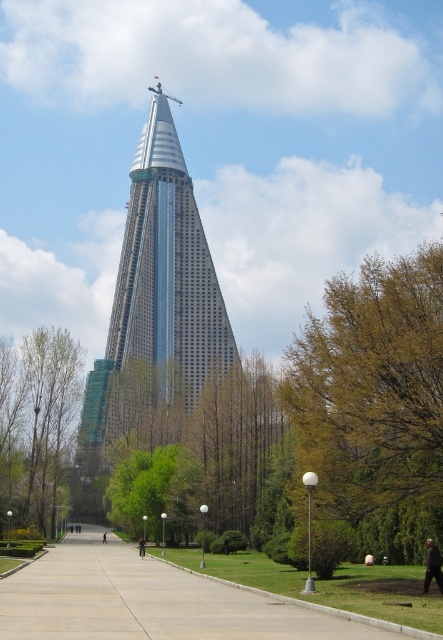
You are standing on the paved pathway leading to the Ryugyong Hotel and see the silver glass tower at center and the black fabric jacket at center. Which object is positioned higher in the scene?

The silver glass tower at center is above the black fabric jacket at center, so it is positioned higher in the scene.

You are standing at the entrance of the pathway leading to the Ryugyong Hotel. You notice a green leafy tree at left. Can you determine the direction of the tree relative to the pathway?

The green leafy tree at left is located at point coordinates indicating it is positioned to the left side of the pathway, so it is to the left of the pathway.